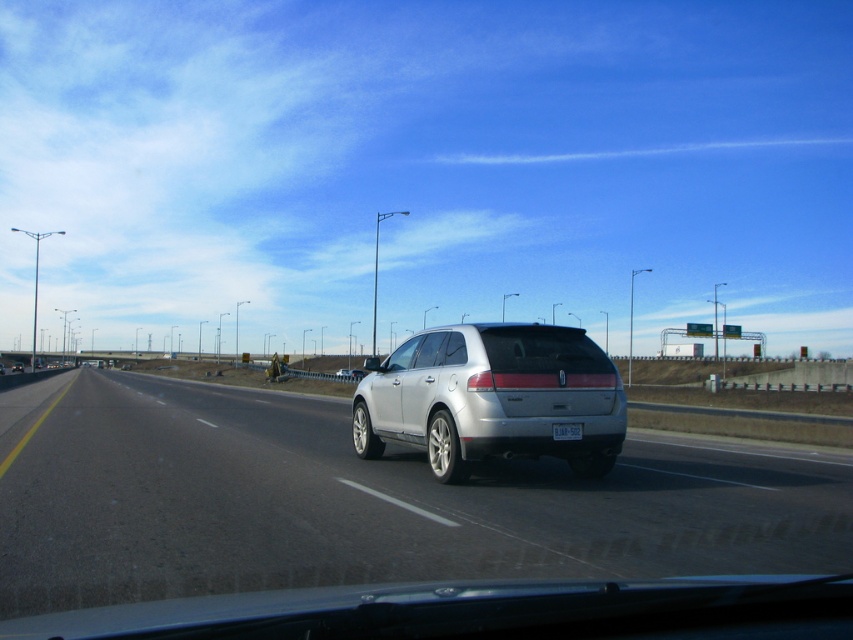
You are a passenger in a car and want to know if you can safely reach the silver metallic suv at center through the clear glass windshield at center without any obstruction. Based on the distance between them, can you confirm if the windshield is long enough to allow a clear view of the suv?

The silver metallic suv at center and clear glass windshield at center are 6.82 meters apart from each other. Since the windshield is part of the car and the SUV is the car itself, the distance indicates the windshield is positioned correctly to provide a clear view of the road ahead, including the SUV if it were another vehicle. However, since the SUV is the same car, the windshield allows the driver to see forward, but the passenger might have an obstructed view depending on seating position.

In the scene shown: You are a passenger in the back seat of the satin silver suv at center. You want to look forward through the clear glass windshield at center. Which side should you turn your head to see the windshield first?

The satin silver suv at center is to the left of the clear glass windshield at center, so you should turn your head to the right to see the windshield first.

You are a passenger in the vehicle and want to see the road ahead through the clear glass windshield at center. Is the satin silver suv at center blocking your view of the road ahead?

The satin silver suv at center is in front of the clear glass windshield at center, so it is blocking the view of the road ahead through the clear glass windshield at center.